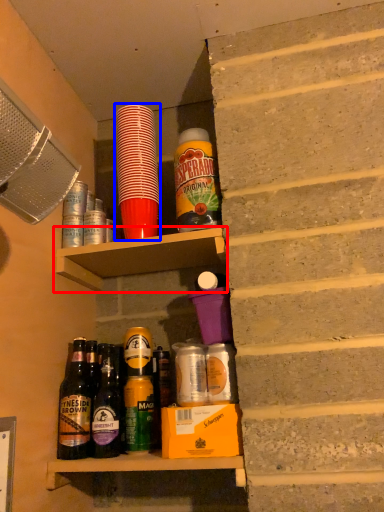
Question: Which object appears closest to the camera in this image, shelf (highlighted by a red box) or bottle (highlighted by a blue box)?

Choices:
 (A) shelf
 (B) bottle

Answer: (A)